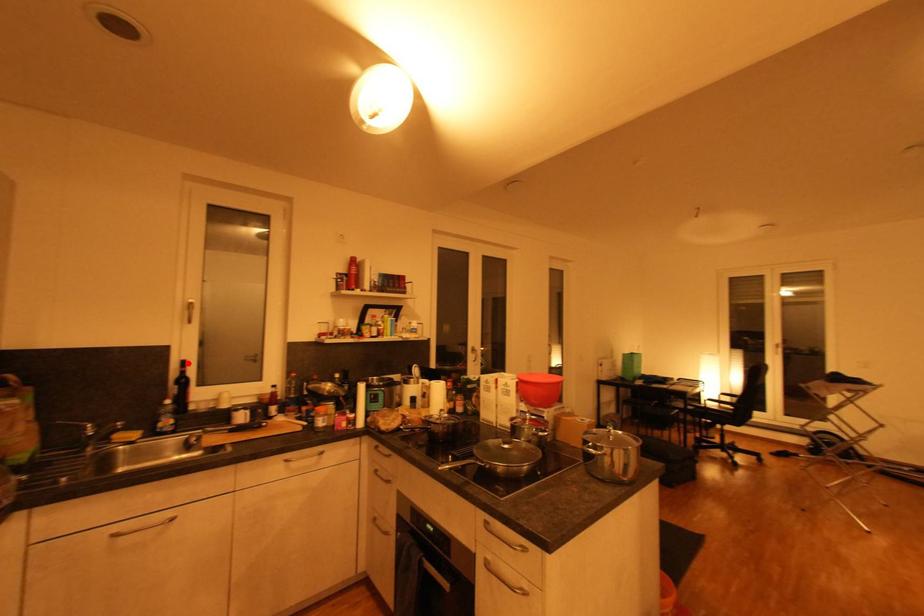
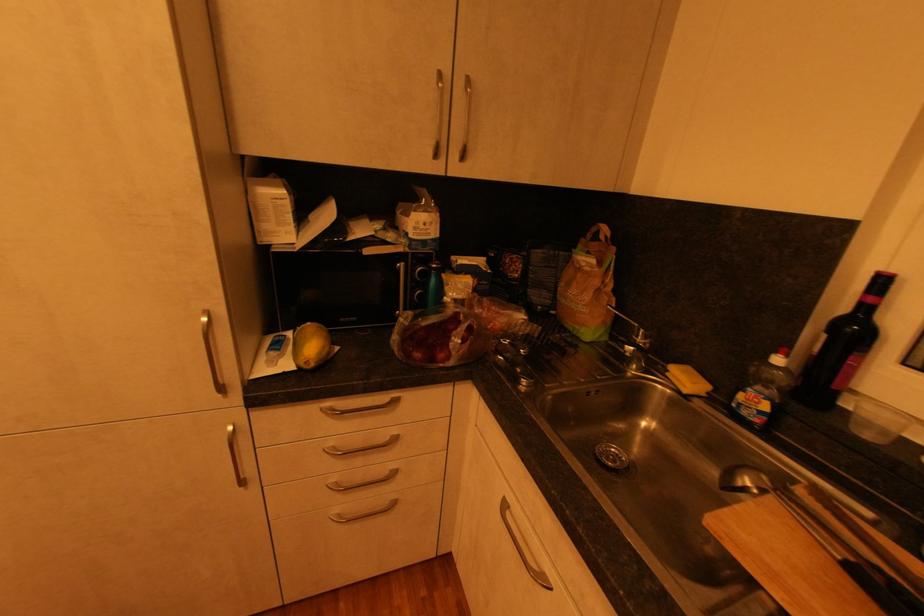
Locate, in the second image, the point that corresponds to the highlighted location in the first image.

(889, 282)